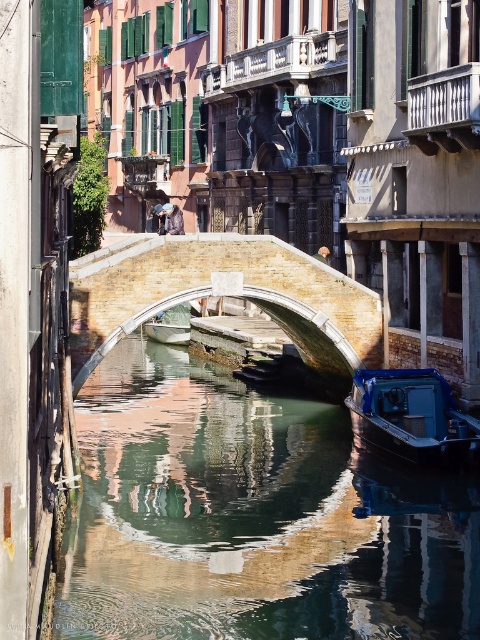
Does shiny reflective water at center appear on the left side of metallic blue boat at center?

No, shiny reflective water at center is not to the left of metallic blue boat at center.

Can you confirm if shiny reflective water at center is bigger than metallic blue boat at center?

Indeed, shiny reflective water at center has a larger size compared to metallic blue boat at center.

From the picture: Who is more distant from viewer, (437, 579) or (154, 339)?

The point (154, 339) is more distant.

Locate an element on the screen. This screenshot has width=480, height=640. shiny reflective water at center is located at coordinates (253, 516).

Can you confirm if brick stone bridge at center is wider than blue plastic boat at lower right?

Yes.

Which is above, brick stone bridge at center or blue plastic boat at lower right?

brick stone bridge at center is above.

Does point (262, 234) lie behind point (381, 404)?

Yes, it is.

Find the location of a particular element. The image size is (480, 640). brick stone bridge at center is located at coordinates (210, 292).

Who is higher up, brick stone bridge at center or metallic blue boat at center?

brick stone bridge at center

Which of these two, brick stone bridge at center or metallic blue boat at center, stands shorter?

metallic blue boat at center

Which is in front, point (72, 289) or point (160, 312)?

Point (72, 289) is more forward.

At what (x,y) coordinates should I click in order to perform the action: click on brick stone bridge at center. Please return your answer as a coordinate pair (x, y). The height and width of the screenshot is (640, 480). Looking at the image, I should click on (210, 292).